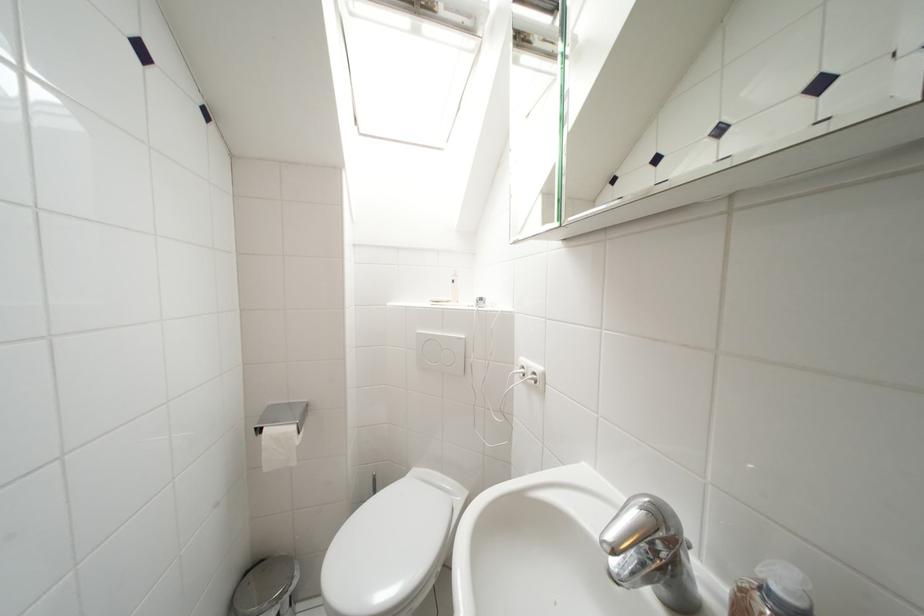
This screenshot has width=924, height=616. Find the location of `small flush button`. small flush button is located at coordinates (x=440, y=352).